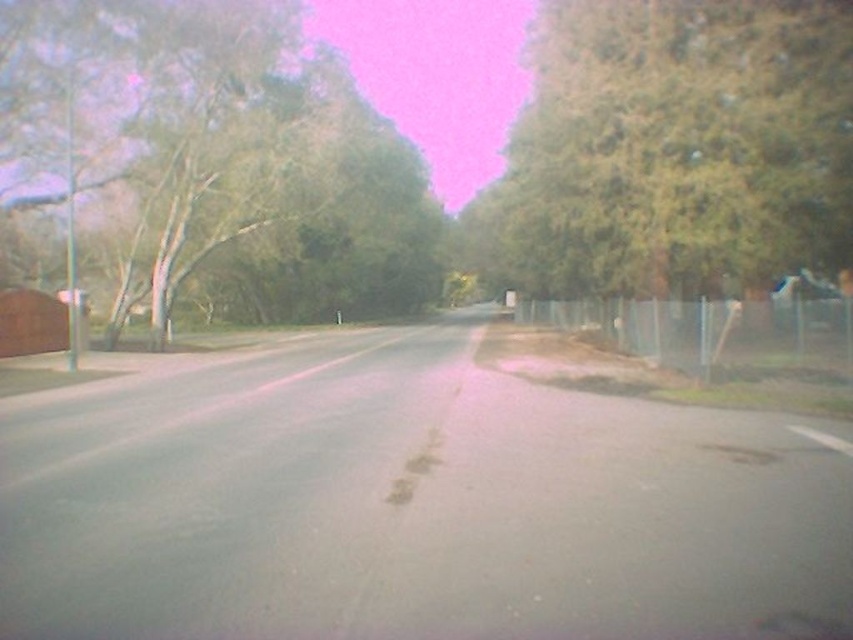
You are a pedestrian standing on the sidewalk and want to walk towards the green leafy tree at left and the green leafy tree at right. Which tree will you reach first?

The green leafy tree at left is closer to you, so you will reach it first because it is further to the viewer than the green leafy tree at right.

You are a photographer trying to capture the green leafy tree at left and the metallic silver fence at right in the same frame. Based on their heights, which object will appear larger in the photo?

The green leafy tree at left is taller than the metallic silver fence at right, so it will appear larger in the photo.